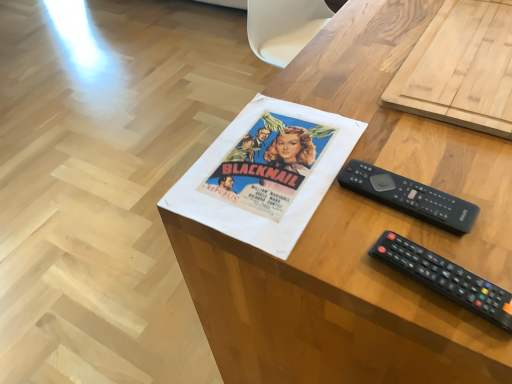
Locate an element on the screen. The height and width of the screenshot is (384, 512). vacant space behind black plastic remote at center right, the 1th remote control when ordered from back to front is located at coordinates (355, 132).